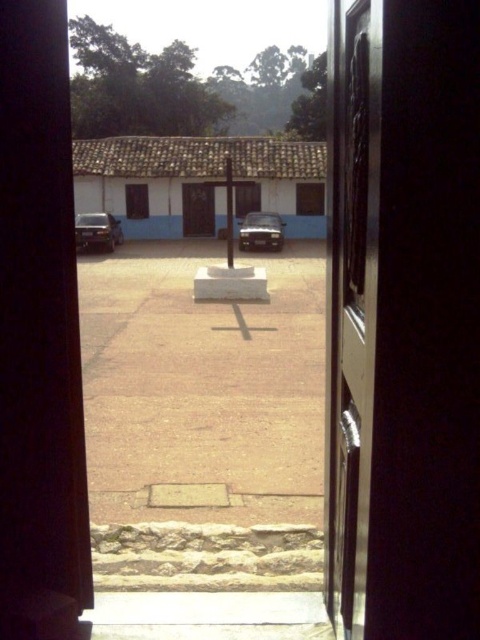
You are trying to decide whether to park your satin silver car at center in the driveway. The polished wood door at center is in the way. Can you fit the car next to the door without moving it?

The polished wood door at center has a lesser width compared to the satin silver car at center. Therefore, the car is wider than the door, so you can park the car next to the door without moving it as there is enough space.

You are a delivery person trying to park a third car in the courtyard. The shiny black car at left is parked closer to the entrance, and the satin silver car at center is parked further away. Based on their sizes, which car would require more space to maneuver around?

The shiny black car at left requires more space to maneuver around since it has a larger size compared to the satin silver car at center.